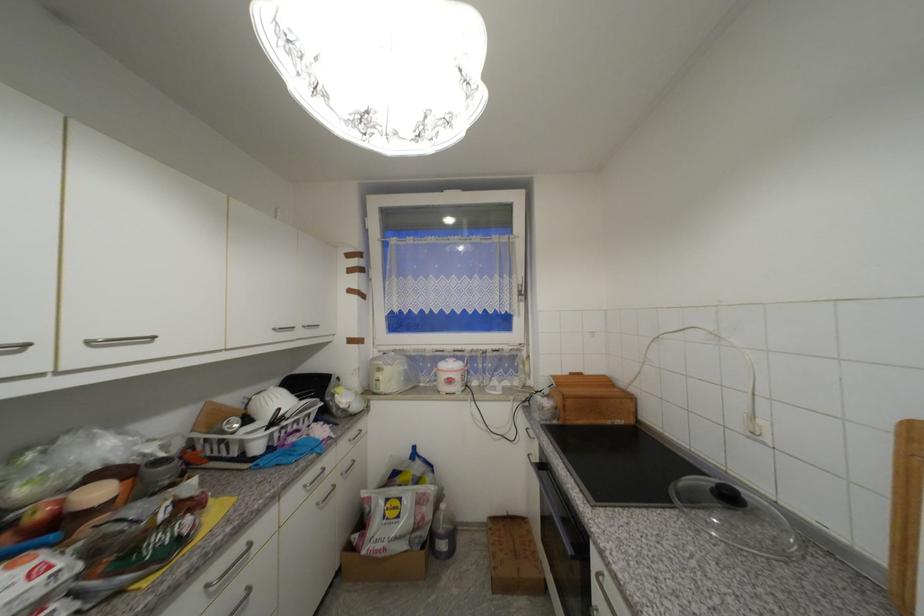
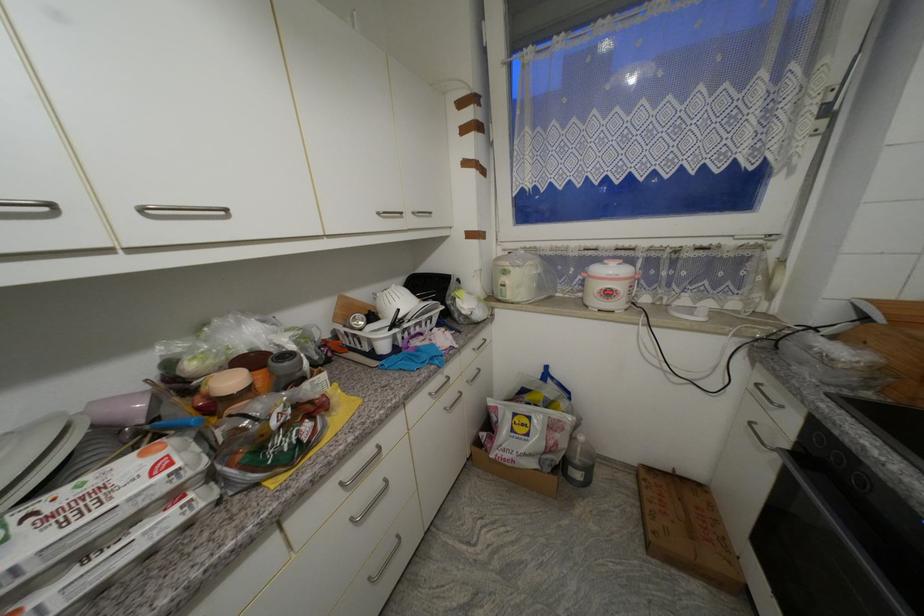
Locate, in the second image, the point that corresponds to (310,328) in the first image.

(419, 215)